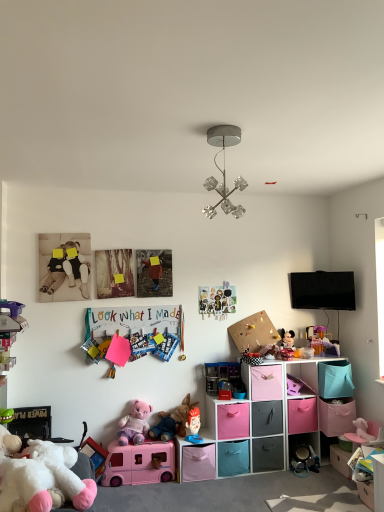
Locate an element on the screen. The image size is (384, 512). vacant space positioned to the left of pink fabric storage box at lower right, marked as the third storage box in a top-to-bottom arrangement is located at coordinates (329, 473).